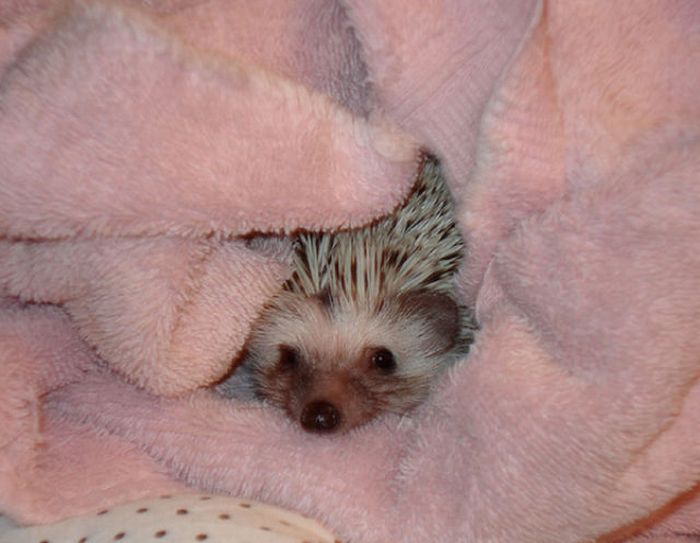
I want to click on small black line on blanket, so click(682, 530).